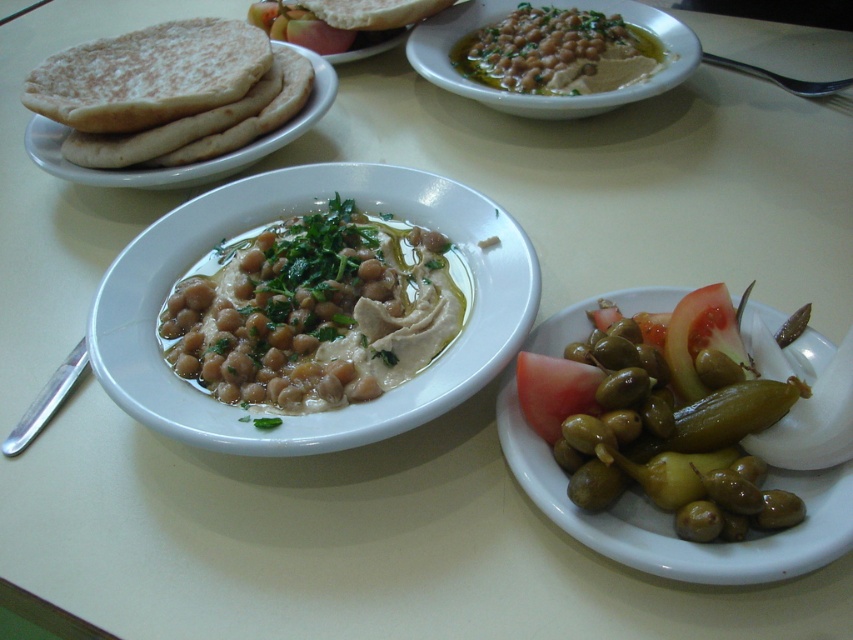
Is point (184, 38) positioned after point (328, 20)?

No, (184, 38) is closer to viewer.

Which is in front, point (71, 106) or point (432, 0)?

Positioned in front is point (71, 106).

The width and height of the screenshot is (853, 640). What are the coordinates of `white flour tortilla at left` in the screenshot? It's located at (149, 74).

Measure the distance between point (560, 490) and camera.

Point (560, 490) and camera are 29.19 inches apart from each other.

Who is higher up, green glossy olives at lower right or green glossy pickle at lower right?

green glossy pickle at lower right is higher up.

You are a GUI agent. You are given a task and a screenshot of the screen. Output one action in this format:
    pyautogui.click(x=<x>, y=<y>)
    Task: Click on the green glossy olives at lower right
    
    Given the screenshot: What is the action you would take?
    pyautogui.click(x=672, y=518)

Where is `green glossy olives at lower right`? green glossy olives at lower right is located at coordinates (672, 518).

Who is positioned more to the left, white flour tortilla at left or green olive at center?

white flour tortilla at left is more to the left.

Does white flour tortilla at left appear under green olive at center?

Yes.

Image resolution: width=853 pixels, height=640 pixels. What do you see at coordinates (149, 74) in the screenshot?
I see `white flour tortilla at left` at bounding box center [149, 74].

Find the location of `white flour tortilla at left`. white flour tortilla at left is located at coordinates (149, 74).